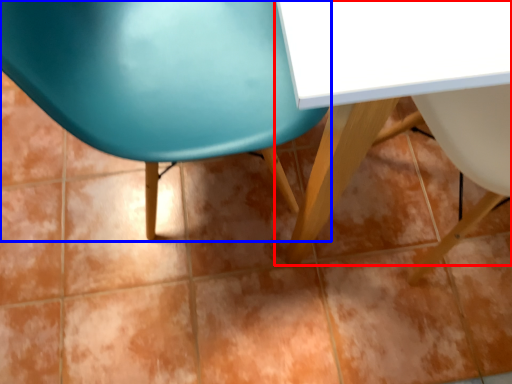
Question: Which of the following is the closest to the observer, table (highlighted by a red box) or chair (highlighted by a blue box)?

Choices:
 (A) table
 (B) chair

Answer: (A)